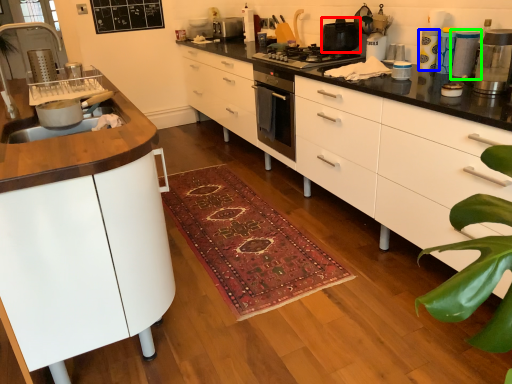
Question: Based on their relative distances, which object is farther from kitchen appliance (highlighted by a red box)? Choose from appliance (highlighted by a blue box) and appliance (highlighted by a green box).

Choices:
 (A) appliance
 (B) appliance

Answer: (B)